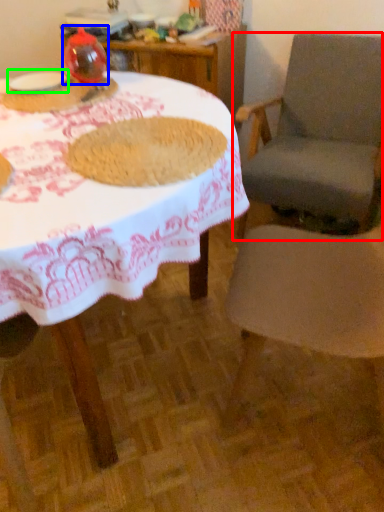
Question: Considering the real-world distances, which object is farthest from chair (highlighted by a red box)? tableware (highlighted by a blue box) or tableware (highlighted by a green box)?

Choices:
 (A) tableware
 (B) tableware

Answer: (B)